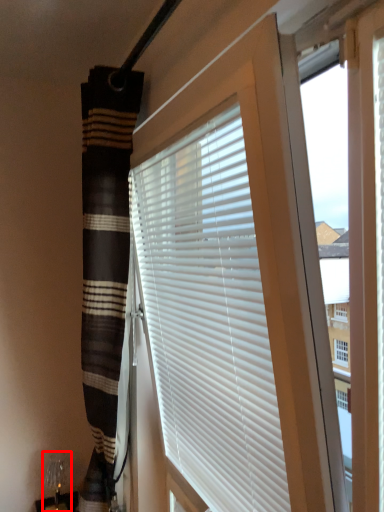
Question: From the image, what is the correct spatial relationship of table lamp (annotated by the red box) in relation to window blind?

Choices:
 (A) right
 (B) left

Answer: (B)